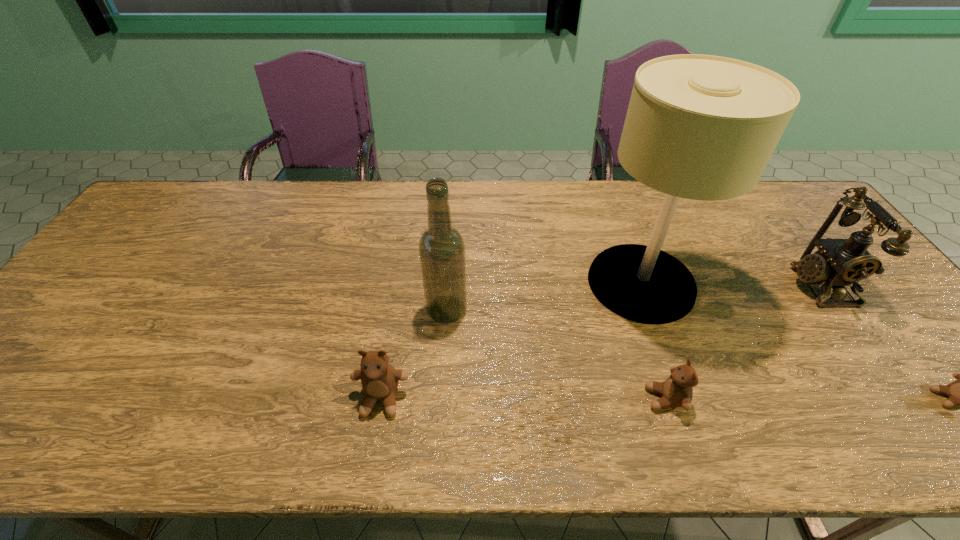
I want to click on the leftmost teddy bear, so click(379, 380).

Image resolution: width=960 pixels, height=540 pixels. I want to click on the third shortest object, so click(x=379, y=380).

You are a GUI agent. You are given a task and a screenshot of the screen. Output one action in this format:
    pyautogui.click(x=<x>, y=<y>)
    Task: Click on the second shortest teddy bear
    The image size is (960, 540).
    Given the screenshot: What is the action you would take?
    pyautogui.click(x=676, y=391)

At what (x,y) coordinates should I click in order to perform the action: click on the fifth tallest object. Please return your answer as a coordinate pair (x, y). This screenshot has width=960, height=540. Looking at the image, I should click on (676, 391).

In order to click on the fifth shortest object in this screenshot , I will do coord(441,248).

Identify the location of the second object from left to right. (441, 248).

Where is `the tallest object`? The width and height of the screenshot is (960, 540). the tallest object is located at coordinates (701, 127).

What are the coordinates of `telephone` in the screenshot? It's located at (838, 262).

Locate an element on the screen. vacant space situated on the front-facing side of the fifth tallest object is located at coordinates (574, 399).

The height and width of the screenshot is (540, 960). In order to click on free space located on the front-facing side of the fifth tallest object in this screenshot , I will do `click(506, 399)`.